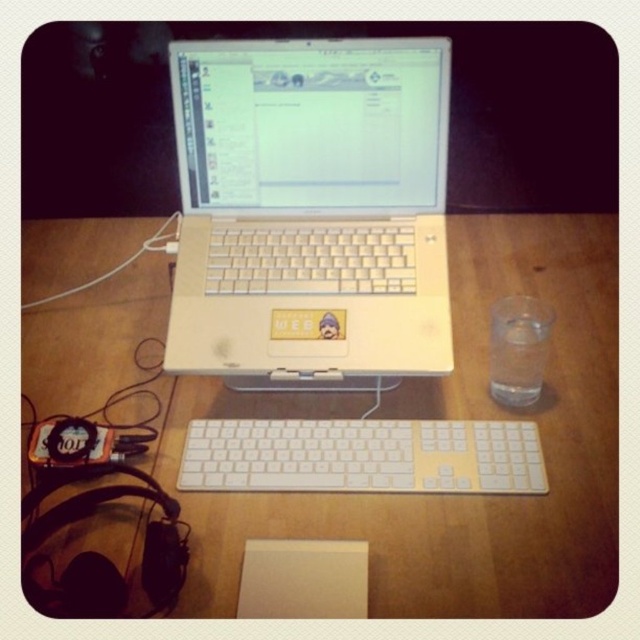
Question: Among these points, which one is nearest to the camera?

Choices:
 (A) (461, 566)
 (B) (513, 346)
 (C) (272, 196)

Answer: (A)

Question: Does white plastic laptop at center have a larger size compared to white plastic keyboard at center?

Choices:
 (A) yes
 (B) no

Answer: (A)

Question: Does wooden table at center appear on the right side of white plastic laptop at center?

Choices:
 (A) no
 (B) yes

Answer: (A)

Question: Does white plastic keyboard at center have a greater width compared to clear glass water at right?

Choices:
 (A) no
 (B) yes

Answer: (B)

Question: Which of these objects is positioned farthest from the wooden table at center?

Choices:
 (A) white plastic keyboard at center
 (B) white plastic laptop at center
 (C) clear glass water at right

Answer: (C)

Question: Estimate the real-world distances between objects in this image. Which object is farther from the white plastic keyboard at center?

Choices:
 (A) wooden table at center
 (B) white plastic laptop at center

Answer: (B)